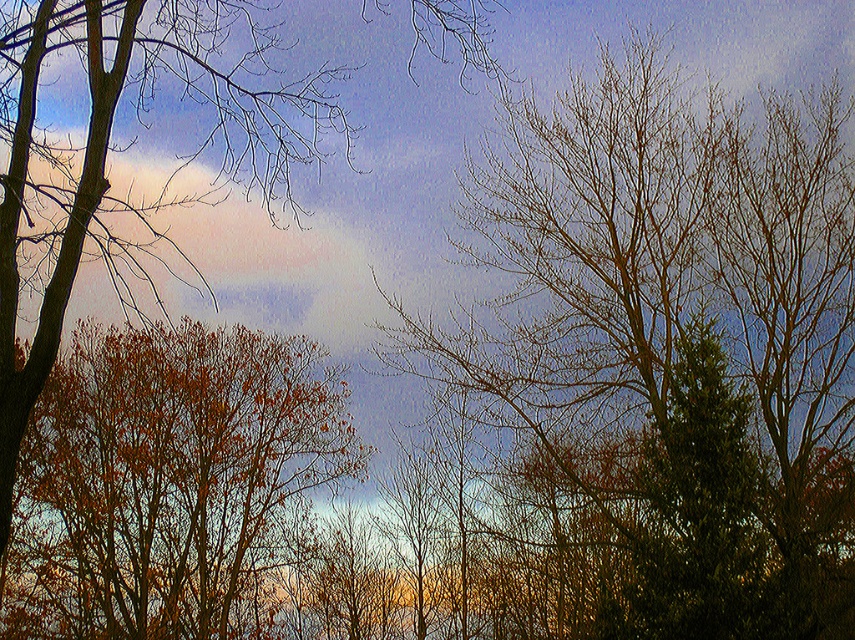
Question: Does bare branches at center have a greater width compared to brown leafy tree at left?

Choices:
 (A) yes
 (B) no

Answer: (A)

Question: Is bare branches at center closer to camera compared to orange-brown foliage at center?

Choices:
 (A) yes
 (B) no

Answer: (A)

Question: Among these points, which one is farthest from the camera?

Choices:
 (A) (103, 99)
 (B) (198, 342)
 (C) (730, 282)

Answer: (B)

Question: Which of the following is the farthest from the observer?

Choices:
 (A) (626, 93)
 (B) (116, 45)
 (C) (157, 604)

Answer: (C)

Question: Can you confirm if orange-brown foliage at center is positioned to the left of brown leafy tree at left?

Choices:
 (A) no
 (B) yes

Answer: (B)

Question: Among these points, which one is farthest from the camera?

Choices:
 (A) (733, 422)
 (B) (352, 460)
 (C) (9, 180)

Answer: (B)